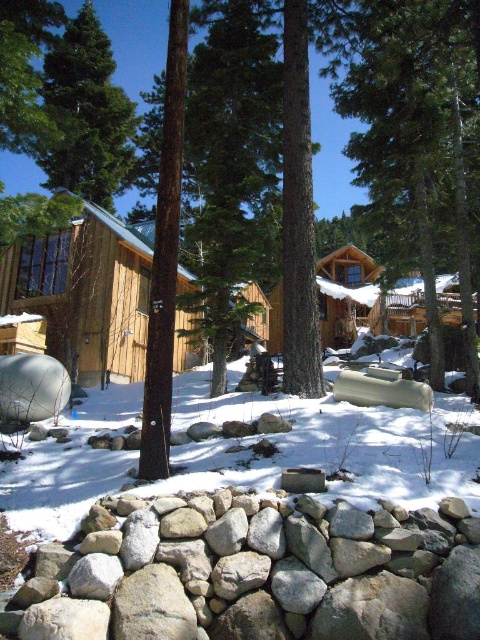
You are standing at point A and want to walk to point B in the winter scene. The coordinates for point A are (156, 522) and point B are 0.455, 0.673. The path between them is 15.86 feet long. If you can walk 3 feet per second, how many seconds will it take you to reach point B?

The distance between the two points is 15.86 feet, and walking at 3 feet per second, it will take approximately 5.29 seconds to reach point B.